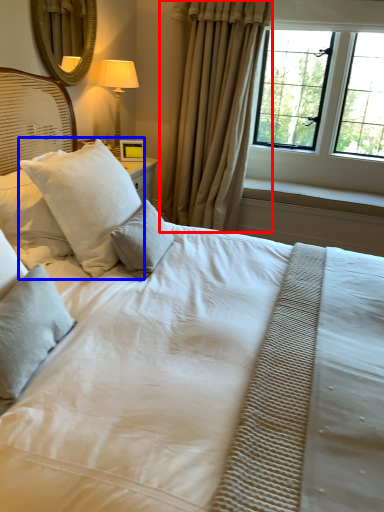
Question: Which object is further to the camera taking this photo, curtain (highlighted by a red box) or pillow (highlighted by a blue box)?

Choices:
 (A) curtain
 (B) pillow

Answer: (A)